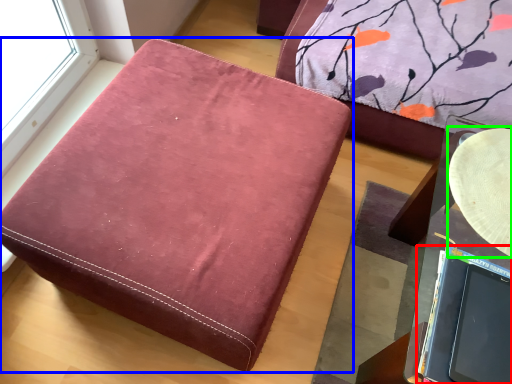
Question: Estimate the real-world distances between objects in this image. Which object is closer to laptop (highlighted by a red box), furniture (highlighted by a blue box) or round table (highlighted by a green box)?

Choices:
 (A) furniture
 (B) round table

Answer: (B)